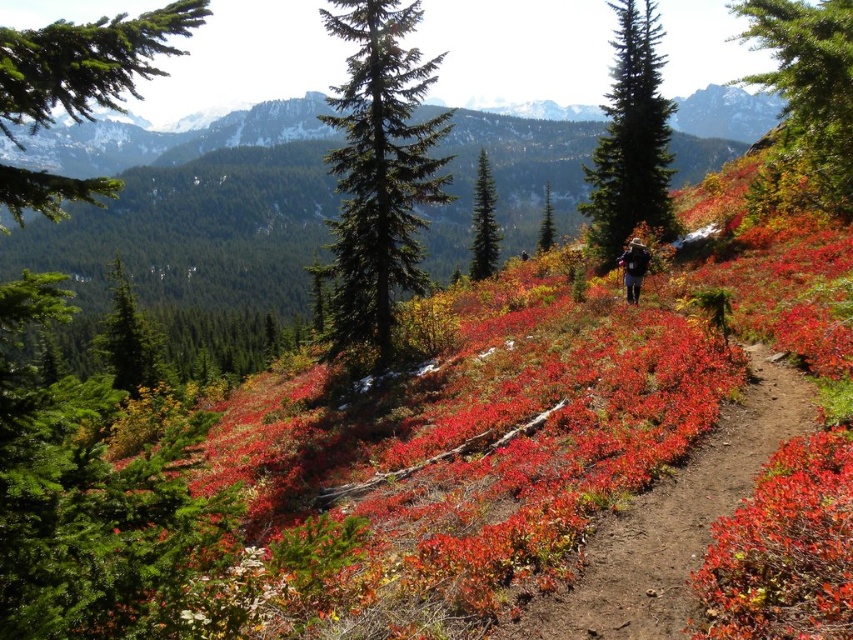
Question: Which point appears farthest from the camera in this image?

Choices:
 (A) (152, 387)
 (B) (485, 193)

Answer: (B)

Question: Where is green needle-like at center located in relation to green textured pine tree at center in the image?

Choices:
 (A) right
 (B) left

Answer: (B)

Question: Is green textured tree at upper right positioned behind matte black backpack at center?

Choices:
 (A) yes
 (B) no

Answer: (B)

Question: Considering the real-world distances, which object is closest to the green textured tree at upper right?

Choices:
 (A) green textured pine tree at center
 (B) matte black backpack at center
 (C) dirt path at center
 (D) green needle-like tree at upper left

Answer: (C)

Question: Can you confirm if dirt path at center is positioned above green needle-like tree at upper left?

Choices:
 (A) yes
 (B) no

Answer: (B)

Question: Which point is farther to the camera?

Choices:
 (A) (474, 216)
 (B) (20, 118)
 (C) (622, 236)

Answer: (A)